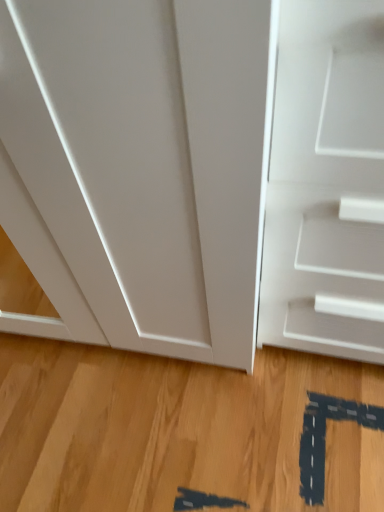
Locate an element on the screen. This screenshot has width=384, height=512. vacant space in front of white matte door at right is located at coordinates (322, 429).